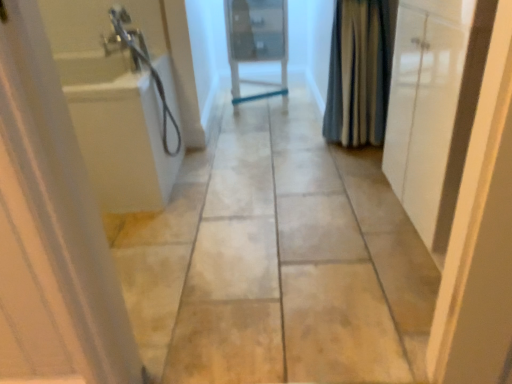
You are a GUI agent. You are given a task and a screenshot of the screen. Output one action in this format:
    pyautogui.click(x=<x>, y=<y>)
    Task: Click on the white glossy cabinet at right, marked as the second door in a front-to-back arrangement
    Image resolution: width=512 pixels, height=384 pixels.
    Given the screenshot: What is the action you would take?
    pyautogui.click(x=431, y=109)

What do you see at coordinates (278, 261) in the screenshot?
I see `beige tile floor at center` at bounding box center [278, 261].

The height and width of the screenshot is (384, 512). Identify the location of white glossy door at left, which ranks as the 3th door in right-to-left order. (51, 229).

Where is `white glossy cabinet at right, which is the 3th door from left to right`? white glossy cabinet at right, which is the 3th door from left to right is located at coordinates (431, 109).

Considering their positions, is beige tile floor at center located in front of or behind white glossy door at left, marked as the 3th door in a back-to-front arrangement?

In the image, beige tile floor at center appears behind white glossy door at left, marked as the 3th door in a back-to-front arrangement.

Does point (234, 331) appear closer or farther from the camera than point (21, 159)?

Point (234, 331) is positioned farther from the camera compared to point (21, 159).

Is beige tile floor at center oriented towards white glossy door at left, marked as the 3th door in a back-to-front arrangement?

No, beige tile floor at center is not facing towards white glossy door at left, marked as the 3th door in a back-to-front arrangement.

From a real-world perspective, is beige tile floor at center positioned over white glossy door at left, which ranks as the 3th door in right-to-left order, based on gravity?

No, from a real-world perspective, beige tile floor at center is not over white glossy door at left, which ranks as the 3th door in right-to-left order

Looking at this image, considering their positions, is blue striped fabric at right located in front of or behind white glossy door at center, placed as the second door when sorted from right to left?

blue striped fabric at right is in front of white glossy door at center, placed as the second door when sorted from right to left.

Can you confirm if blue striped fabric at right is positioned to the left of white glossy door at center, placed as the second door when sorted from right to left?

No, blue striped fabric at right is not to the left of white glossy door at center, placed as the second door when sorted from right to left.

Locate an element on the screen. door lying behind the blue striped fabric at right is located at coordinates (256, 40).

From the picture: Does blue striped fabric at right have a lesser width compared to white glossy door at center, the second door from the left?

Indeed, blue striped fabric at right has a lesser width compared to white glossy door at center, the second door from the left.

Does white glossy cabinet at right, marked as the second door in a front-to-back arrangement, lie in front of beige tile floor at center?

That is True.

Considering the positions of objects white glossy cabinet at right, arranged as the second door when viewed from the back, and beige tile floor at center in the image provided, who is more to the right, white glossy cabinet at right, arranged as the second door when viewed from the back, or beige tile floor at center?

Positioned to the right is white glossy cabinet at right, arranged as the second door when viewed from the back.

Is white glossy cabinet at right, marked as the second door in a front-to-back arrangement, smaller than beige tile floor at center?

Correct, white glossy cabinet at right, marked as the second door in a front-to-back arrangement, occupies less space than beige tile floor at center.

From a real-world perspective, is white glossy cabinet at right, marked as the second door in a front-to-back arrangement, located higher than beige tile floor at center?

Correct, in the physical world, white glossy cabinet at right, marked as the second door in a front-to-back arrangement, is higher than beige tile floor at center.

Would you consider white glossy door at left, which is counted as the first door, starting from the front, to be distant from beige tile floor at center?

No, white glossy door at left, which is counted as the first door, starting from the front, is not far from beige tile floor at center.

Is white glossy door at left, which ranks as the 3th door in right-to-left order, situated inside beige tile floor at center or outside?

white glossy door at left, which ranks as the 3th door in right-to-left order, exists outside the volume of beige tile floor at center.

Consider the image. How many degrees apart are the facing directions of white glossy door at left, which is the first door in left-to-right order, and beige tile floor at center?

The angular difference between white glossy door at left, which is the first door in left-to-right order, and beige tile floor at center is 178 degrees.

In the scene shown: From a real-world perspective, is white glossy door at left, which is counted as the first door, starting from the front, below beige tile floor at center?

Actually, white glossy door at left, which is counted as the first door, starting from the front, is physically above beige tile floor at center in the real world.

Which object is closer to the camera taking this photo, white glossy door at left, which is counted as the first door, starting from the front, or white glossy door at center, the third door when ordered from front to back?

white glossy door at left, which is counted as the first door, starting from the front, is closer to the camera.

Is white glossy door at left, marked as the 3th door in a back-to-front arrangement, at the left side of white glossy door at center, placed as the second door when sorted from right to left?

Indeed, white glossy door at left, marked as the 3th door in a back-to-front arrangement, is positioned on the left side of white glossy door at center, placed as the second door when sorted from right to left.

Is white glossy door at left, marked as the 3th door in a back-to-front arrangement, far away from white glossy door at center, placed as the second door when sorted from right to left?

That's right, there is a large distance between white glossy door at left, marked as the 3th door in a back-to-front arrangement, and white glossy door at center, placed as the second door when sorted from right to left.

How many degrees apart are the facing directions of white glossy door at left, marked as the 3th door in a back-to-front arrangement, and white glossy door at center, the 1th door from the back?

The facing directions of white glossy door at left, marked as the 3th door in a back-to-front arrangement, and white glossy door at center, the 1th door from the back, are 177 degrees apart.

Is point (311, 263) positioned behind point (412, 81)?

That is True.

From a real-world perspective, is beige tile floor at center on white glossy cabinet at right, which is the 1th door from right to left?

Actually, beige tile floor at center is physically below white glossy cabinet at right, which is the 1th door from right to left, in the real world.

Between beige tile floor at center and white glossy cabinet at right, which is the 1th door from right to left, which one is positioned behind?

beige tile floor at center is further away from the camera.

Identify the location of door that is the 1st one below the white glossy door at left, which is counted as the first door, starting from the front (from a real-world perspective). The image size is (512, 384). pos(431,109).

Considering the relative sizes of white glossy cabinet at right, arranged as the second door when viewed from the back, and white glossy door at left, which ranks as the 3th door in right-to-left order, in the image provided, is white glossy cabinet at right, arranged as the second door when viewed from the back, thinner than white glossy door at left, which ranks as the 3th door in right-to-left order,?

Incorrect, the width of white glossy cabinet at right, arranged as the second door when viewed from the back, is not less than that of white glossy door at left, which ranks as the 3th door in right-to-left order.

Consider the image. Is white glossy cabinet at right, which is the 3th door from left to right, at the left side of white glossy door at left, which is the first door in left-to-right order?

No, white glossy cabinet at right, which is the 3th door from left to right, is not to the left of white glossy door at left, which is the first door in left-to-right order.

Does white glossy cabinet at right, which is the 3th door from left to right, touch white glossy door at left, marked as the 3th door in a back-to-front arrangement?

No, white glossy cabinet at right, which is the 3th door from left to right, is not in contact with white glossy door at left, marked as the 3th door in a back-to-front arrangement.

This screenshot has height=384, width=512. What are the coordinates of `path on the right of white glossy door at left, which ranks as the 3th door in right-to-left order` in the screenshot? It's located at (278, 261).

Where is `shower curtain above the white glossy door at center, the third door when ordered from front to back (from a real-world perspective)`? The image size is (512, 384). shower curtain above the white glossy door at center, the third door when ordered from front to back (from a real-world perspective) is located at coordinates (358, 73).

Based on their spatial positions, is white glossy cabinet at right, which is the 1th door from right to left, or blue striped fabric at right further from white glossy door at left, which is the first door in left-to-right order?

Among the two, blue striped fabric at right is located further to white glossy door at left, which is the first door in left-to-right order.

Considering their positions, is blue striped fabric at right positioned closer to white glossy door at center, the third door when ordered from front to back, than white glossy cabinet at right, which is the 3th door from left to right?

blue striped fabric at right is positioned closer to the anchor white glossy door at center, the third door when ordered from front to back.

When comparing their distances from white glossy door at left, which ranks as the 3th door in right-to-left order, does blue striped fabric at right or white glossy cabinet at right, marked as the second door in a front-to-back arrangement, seem further?

The object further to white glossy door at left, which ranks as the 3th door in right-to-left order, is blue striped fabric at right.

When comparing their distances from white glossy door at center, placed as the second door when sorted from right to left, does white glossy door at left, marked as the 3th door in a back-to-front arrangement, or beige tile floor at center seem closer?

beige tile floor at center.

Based on the photo, considering their positions, is white glossy cabinet at right, marked as the second door in a front-to-back arrangement, positioned further to white glossy door at left, marked as the 3th door in a back-to-front arrangement, than beige tile floor at center?

white glossy cabinet at right, marked as the second door in a front-to-back arrangement.

Based on their spatial positions, is white glossy cabinet at right, which is the 3th door from left to right, or white glossy door at center, the second door from the left, closer to beige tile floor at center?

white glossy cabinet at right, which is the 3th door from left to right, is positioned closer to the anchor beige tile floor at center.

Looking at the image, which one is located closer to white glossy cabinet at right, arranged as the second door when viewed from the back, beige tile floor at center or white glossy door at left, marked as the 3th door in a back-to-front arrangement?

Among the two, beige tile floor at center is located nearer to white glossy cabinet at right, arranged as the second door when viewed from the back.

When comparing their distances from white glossy door at left, marked as the 3th door in a back-to-front arrangement, does white glossy door at center, the third door when ordered from front to back, or blue striped fabric at right seem further?

Based on the image, white glossy door at center, the third door when ordered from front to back, appears to be further to white glossy door at left, marked as the 3th door in a back-to-front arrangement.

I want to click on path between white glossy door at left, which is the first door in left-to-right order, and blue striped fabric at right, in the horizontal direction, so click(x=278, y=261).

At what (x,y) coordinates should I click in order to perform the action: click on path between white glossy cabinet at right, which is the 3th door from left to right, and white glossy door at center, placed as the second door when sorted from right to left, in the front-back direction. Please return your answer as a coordinate pair (x, y). Image resolution: width=512 pixels, height=384 pixels. Looking at the image, I should click on (278, 261).

Find the location of a particular element. This screenshot has width=512, height=384. shower curtain between beige tile floor at center and white glossy door at center, the 1th door from the back, in the front-back direction is located at coordinates (358, 73).

Locate an element on the screen. path between white glossy door at left, which ranks as the 3th door in right-to-left order, and white glossy door at center, the third door when ordered from front to back, along the z-axis is located at coordinates (278, 261).